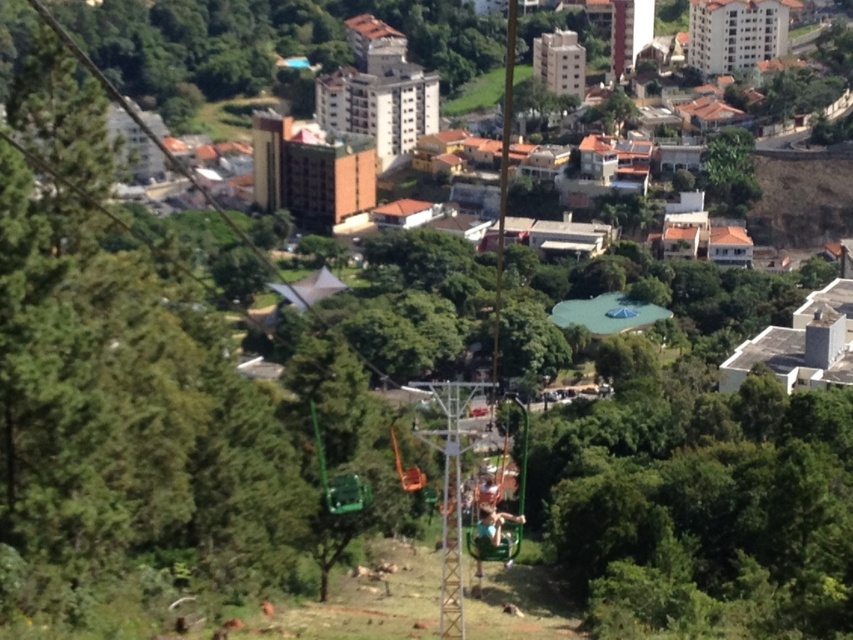
Question: Does green leafy tree at center have a smaller size compared to green leafy tree at upper right?

Choices:
 (A) yes
 (B) no

Answer: (B)

Question: Is green leafy tree at center further to camera compared to green leafy tree at upper right?

Choices:
 (A) no
 (B) yes

Answer: (A)

Question: Is green leafy tree at center positioned before green leafy tree at upper right?

Choices:
 (A) yes
 (B) no

Answer: (A)